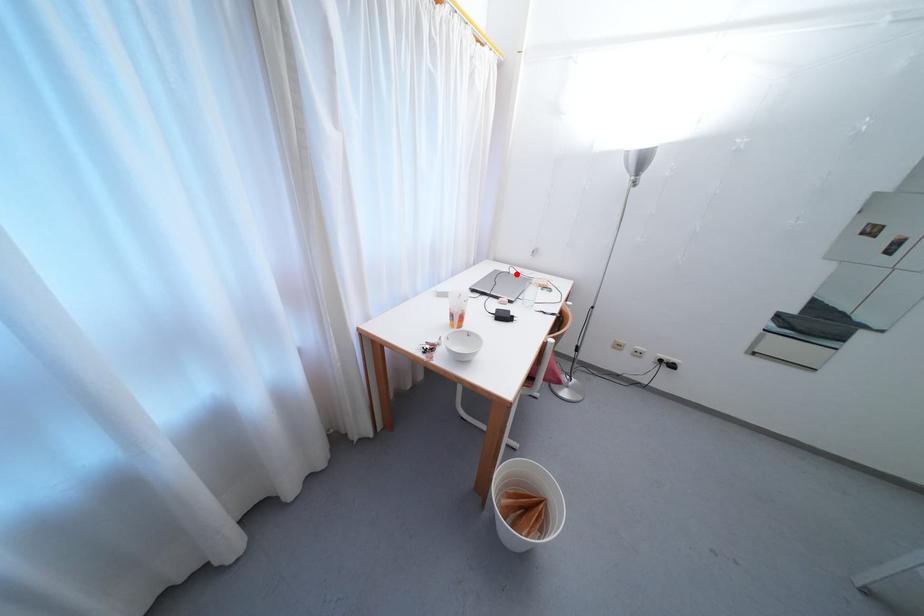
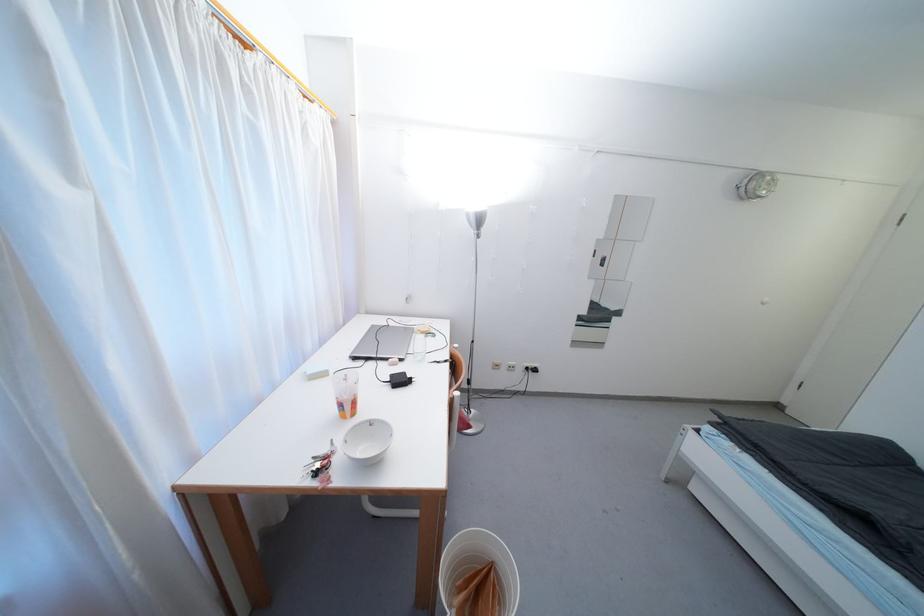
Question: I am providing you with two images of the same scene from different viewpoints. A red point is marked on the first image. Can you still see the location of the red point in image 2?

Choices:
 (A) Yes
 (B) No

Answer: (A)